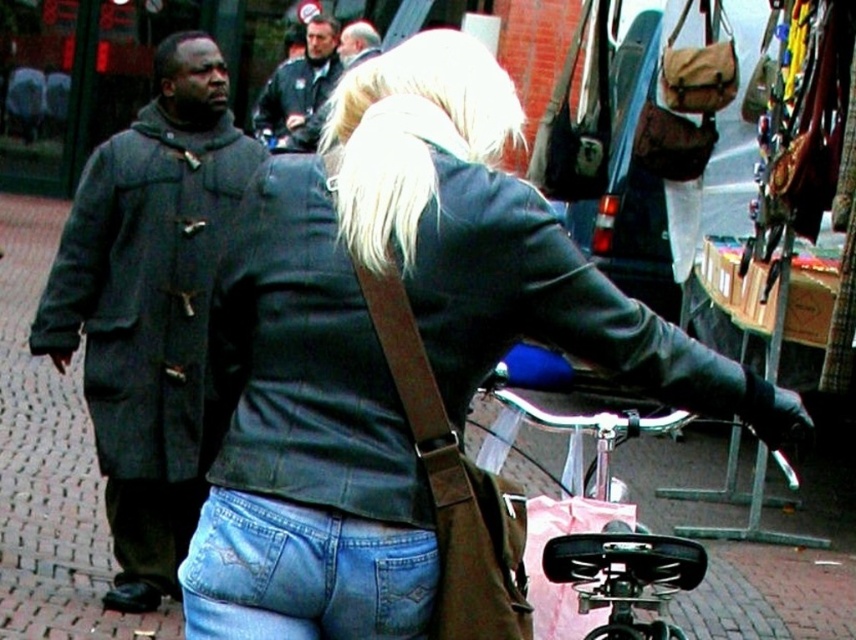
Based on the photo, you are a delivery robot positioned at the edge of the pedestrian zone. You need to deliver a package to the person wearing denim jeans at lower center and the person holding the brown leather bag at center. Which person should you approach first to ensure you reach them without moving past the other?

You should approach the denim jeans at lower center first because it is closer to the viewer, so you can reach them without needing to move past the brown leather bag at center which is further away.

You are a delivery person who needs to quickly move your shiny black bicycle at center to the right side of the matte black jacket at center. Is this possible given their current positions?

The matte black jacket at center is to the left of the shiny black bicycle at center, so moving the bicycle to the right of the jacket would require shifting it further to the right side of the jacket, which is possible as long as there is space available on the right side.